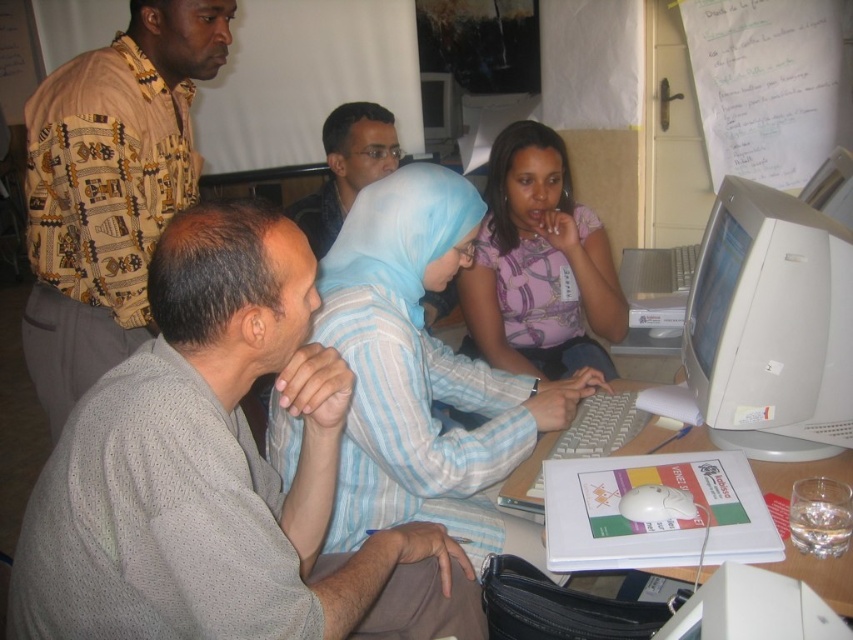
You are observing a group of people around a computer workstation. You notice the purple printed shirt at center and the white glossy computer monitor at upper center. Which object is nearer to you?

The purple printed shirt at center is closer to the viewer than the white glossy computer monitor at upper center.

You are observing a group of people around a computer workstation. Which object is positioned above the other between the purple printed shirt at center and the white glossy computer monitor at upper center?

The white glossy computer monitor at upper center is positioned above the purple printed shirt at center.

You are standing in the office and need to locate the purple printed shirt at center and the white plastic table at center. According to the scene, which object is positioned to the right?

The white plastic table at center is to the right of the purple printed shirt at center.